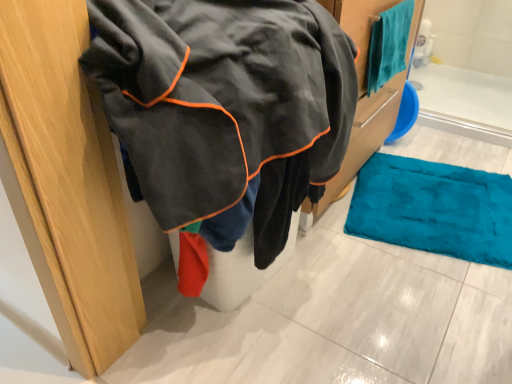
Question: Would you say velvet-like black jacket at left is outside teal soft towel at upper right?

Choices:
 (A) no
 (B) yes

Answer: (B)

Question: Could you tell me if velvet-like black jacket at left is turned towards teal soft towel at upper right?

Choices:
 (A) no
 (B) yes

Answer: (A)

Question: Does velvet-like black jacket at left have a lesser width compared to teal soft towel at upper right?

Choices:
 (A) no
 (B) yes

Answer: (A)

Question: Can you confirm if velvet-like black jacket at left is taller than teal soft towel at upper right?

Choices:
 (A) no
 (B) yes

Answer: (B)

Question: From a real-world perspective, is velvet-like black jacket at left on teal soft towel at upper right?

Choices:
 (A) no
 (B) yes

Answer: (A)

Question: Does velvet-like black jacket at left come behind teal soft towel at upper right?

Choices:
 (A) yes
 (B) no

Answer: (B)

Question: Does teal soft towel at upper right lie in front of velvet-like black jacket at left?

Choices:
 (A) yes
 (B) no

Answer: (B)

Question: From the image's perspective, is teal soft towel at upper right located above velvet-like black jacket at left?

Choices:
 (A) no
 (B) yes

Answer: (B)

Question: Considering the relative sizes of teal soft towel at upper right and velvet-like black jacket at left in the image provided, is teal soft towel at upper right thinner than velvet-like black jacket at left?

Choices:
 (A) no
 (B) yes

Answer: (B)

Question: Does teal soft towel at upper right have a greater height compared to velvet-like black jacket at left?

Choices:
 (A) yes
 (B) no

Answer: (B)

Question: Can you confirm if teal soft towel at upper right is smaller than velvet-like black jacket at left?

Choices:
 (A) yes
 (B) no

Answer: (A)

Question: Could you tell me if teal soft towel at upper right is turned towards velvet-like black jacket at left?

Choices:
 (A) yes
 (B) no

Answer: (B)

Question: Visually, is velvet-like black jacket at left positioned to the left or to the right of teal soft towel at upper right?

Choices:
 (A) right
 (B) left

Answer: (B)